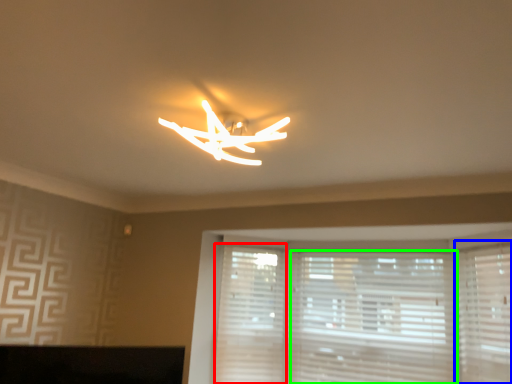
Question: Considering the real-world distances, which object is farthest from shutter (highlighted by a red box)? shutter (highlighted by a blue box) or blind (highlighted by a green box)?

Choices:
 (A) shutter
 (B) blind

Answer: (A)